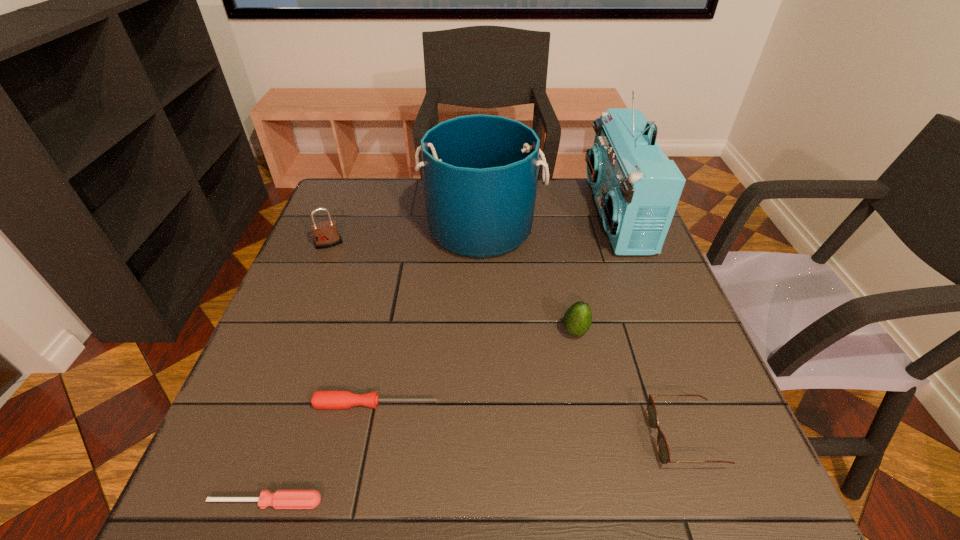
The image size is (960, 540). Find the location of `vacant space situated on the front-facing side of the radio receiver`. vacant space situated on the front-facing side of the radio receiver is located at coordinates (520, 215).

Where is `vacant space located on the front of the bucket`? The width and height of the screenshot is (960, 540). vacant space located on the front of the bucket is located at coordinates (482, 303).

I want to click on vacant space located on the right of the padlock, so click(x=375, y=244).

What are the coordinates of `vacant space located on the back of the fifth object from left to right` in the screenshot? It's located at (563, 271).

At what (x,y) coordinates should I click in order to perform the action: click on free region located at the front view of the third shortest object. Please return your answer as a coordinate pair (x, y). The height and width of the screenshot is (540, 960). Looking at the image, I should click on (541, 438).

The height and width of the screenshot is (540, 960). What are the coordinates of `blank space located at the front view of the third shortest object` in the screenshot? It's located at (558, 438).

Image resolution: width=960 pixels, height=540 pixels. I want to click on vacant space situated at the front view of the third shortest object, so click(x=575, y=438).

Locate an element on the screen. free space located 0.060m at the tip of the farther screwdriver is located at coordinates (469, 404).

Identify the location of vacant region located on the right of the nearest object. click(x=453, y=502).

The width and height of the screenshot is (960, 540). I want to click on radio receiver located in the far edge section of the desktop, so click(x=637, y=188).